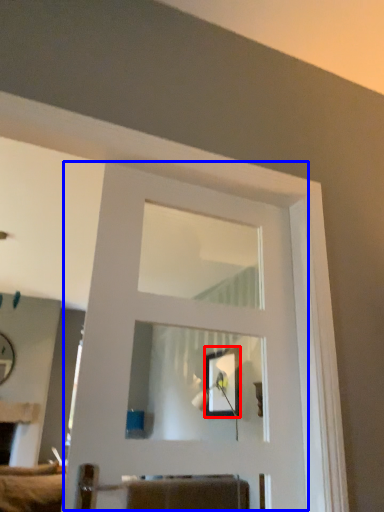
Question: Which object appears farthest to the camera in this image, picture frame (highlighted by a red box) or door (highlighted by a blue box)?

Choices:
 (A) picture frame
 (B) door

Answer: (A)